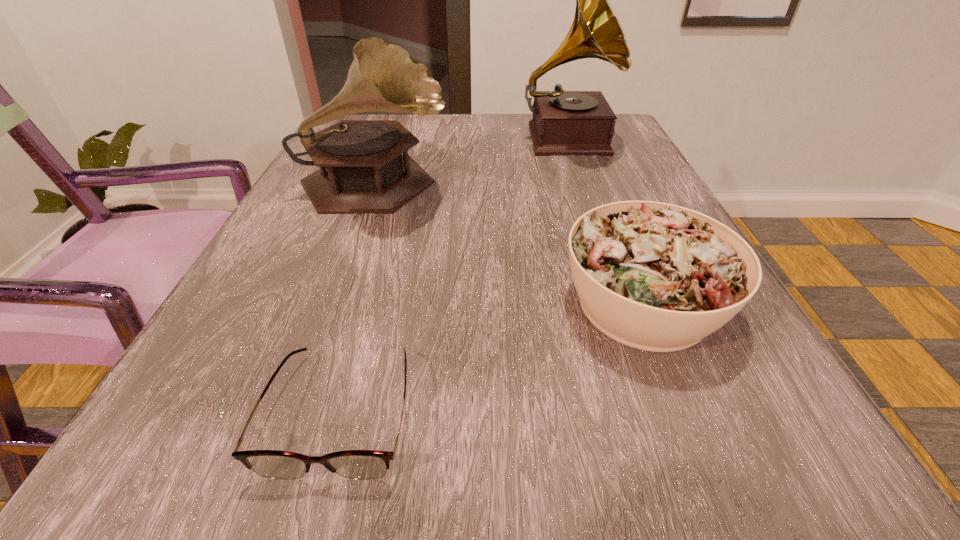
At what (x,y) coordinates should I click in order to perform the action: click on vacant space that is in between the right phonograph record and the spectacles. Please return your answer as a coordinate pair (x, y). Looking at the image, I should click on (454, 275).

Where is `vacant point located between the right phonograph record and the shortest object`? The height and width of the screenshot is (540, 960). vacant point located between the right phonograph record and the shortest object is located at coordinates (454, 275).

This screenshot has width=960, height=540. I want to click on object that is the third closest to the shortest object, so click(x=564, y=122).

Where is `object that is the third nearest to the tallest object`? This screenshot has width=960, height=540. object that is the third nearest to the tallest object is located at coordinates (354, 464).

The image size is (960, 540). Identify the location of vacant area that satisfies the following two spatial constraints: 1. from the horn of the salad; 2. on the right side of the taller phonograph record. (623, 304).

The width and height of the screenshot is (960, 540). In order to click on vacant region that satisfies the following two spatial constraints: 1. from the horn of the right phonograph record; 2. on the horn direction of the left phonograph record in this screenshot , I will do click(x=583, y=187).

Where is `vacant region that satisfies the following two spatial constraints: 1. from the horn of the right phonograph record; 2. on the horn direction of the shorter phonograph record`? The image size is (960, 540). vacant region that satisfies the following two spatial constraints: 1. from the horn of the right phonograph record; 2. on the horn direction of the shorter phonograph record is located at coordinates (583, 187).

Find the location of `vacant space that satisfies the following two spatial constraints: 1. on the horn direction of the left phonograph record; 2. on the back side of the salad`. vacant space that satisfies the following two spatial constraints: 1. on the horn direction of the left phonograph record; 2. on the back side of the salad is located at coordinates (332, 304).